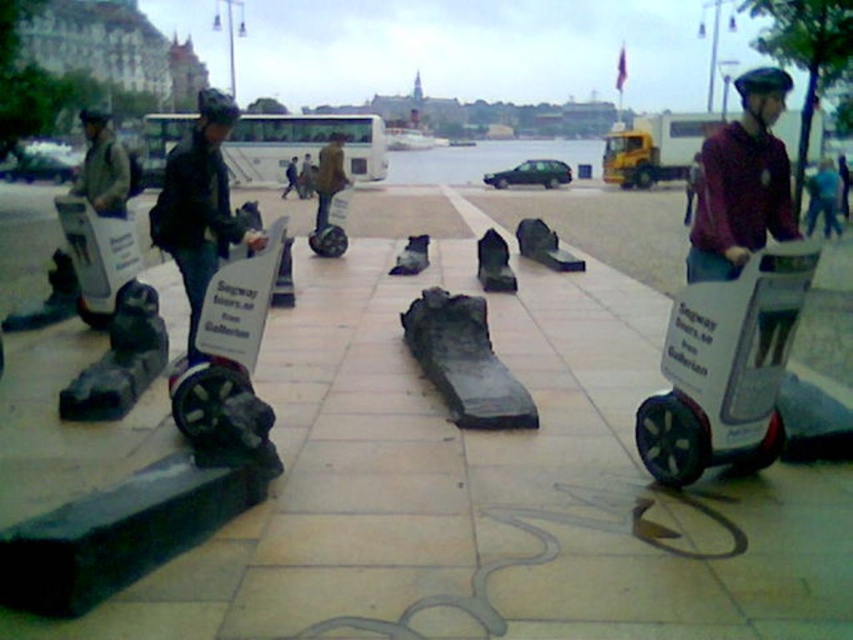
Question: Which is farther from the brown leather jacket at center?

Choices:
 (A) matte black helmet at left
 (B) purple matte helmet at upper right

Answer: (B)

Question: Is matte black helmet at left further to camera compared to blue fabric helmet at upper right?

Choices:
 (A) no
 (B) yes

Answer: (A)

Question: Is matte black segway at center positioned at the back of dark blue jeans at center?

Choices:
 (A) no
 (B) yes

Answer: (A)

Question: Which object is closer to the camera taking this photo?

Choices:
 (A) matte black helmet at left
 (B) smooth concrete slabs at center
 (C) dark blue jeans at center

Answer: (B)

Question: Considering the relative positions of matte black segway at center and matte black helmet at left in the image provided, where is matte black segway at center located with respect to matte black helmet at left?

Choices:
 (A) below
 (B) above

Answer: (A)

Question: Among these objects, which one is farthest from the camera?

Choices:
 (A) matte black helmet at left
 (B) matte black segway at center

Answer: (A)